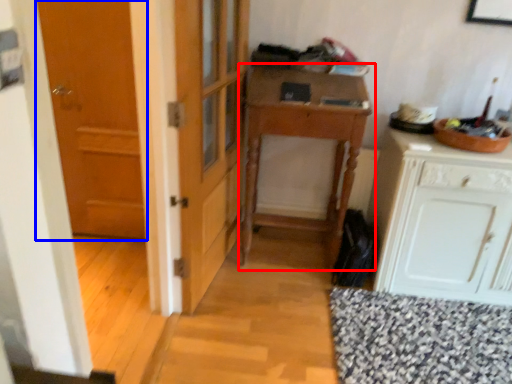
Question: Which point is further to the camera, table (highlighted by a red box) or door (highlighted by a blue box)?

Choices:
 (A) table
 (B) door

Answer: (B)